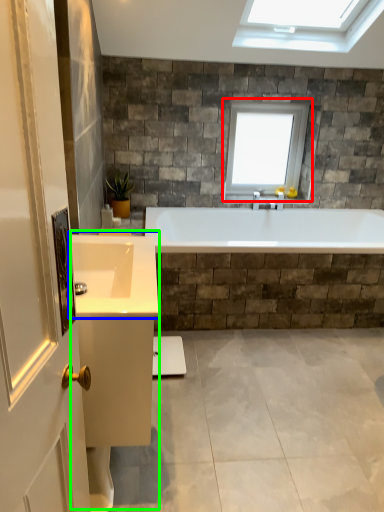
Question: Which object is the farthest from window (highlighted by a red box)? Choose among these: sink (highlighted by a blue box) or vanity (highlighted by a green box).

Choices:
 (A) sink
 (B) vanity

Answer: (B)